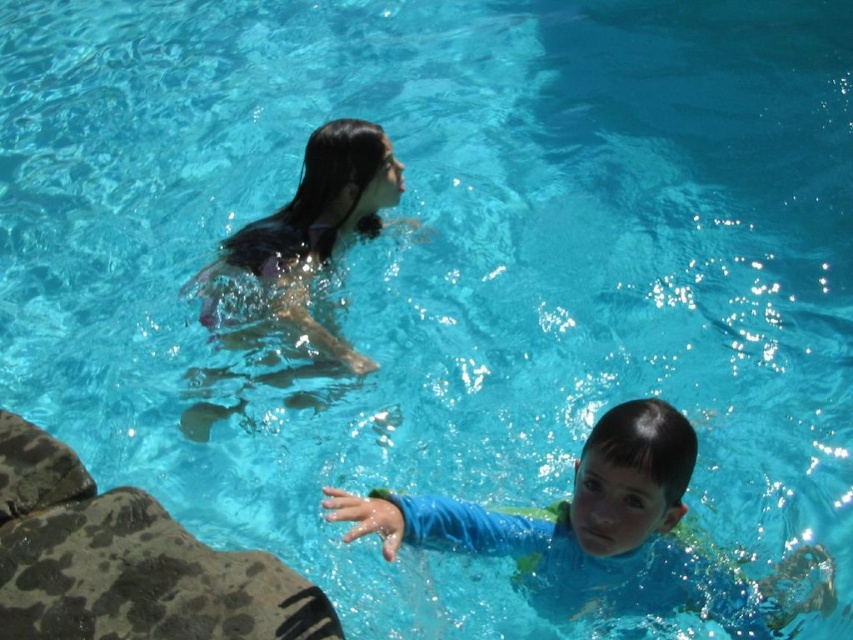
Question: Observing the image, what is the correct spatial positioning of blue rubber swim suit at center in reference to wet hair at upper center?

Choices:
 (A) left
 (B) right

Answer: (B)

Question: From the image, what is the correct spatial relationship of blue rubber swim suit at center in relation to wet hair at upper center?

Choices:
 (A) right
 (B) left

Answer: (A)

Question: From the image, what is the correct spatial relationship of blue rubber swim suit at center in relation to wet hair at upper center?

Choices:
 (A) left
 (B) right

Answer: (B)